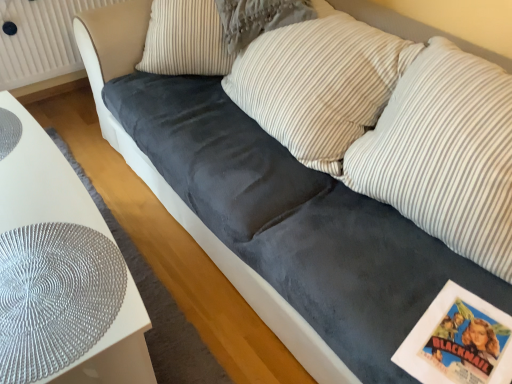
Question: Does white textured radiator at upper left have a larger size compared to striped fabric pillow at center, the 2th pillow when ordered from left to right?

Choices:
 (A) yes
 (B) no

Answer: (B)

Question: From the image's perspective, is white textured radiator at upper left on striped fabric pillow at center, placed as the 3th pillow when sorted from right to left?

Choices:
 (A) yes
 (B) no

Answer: (A)

Question: Considering the relative sizes of white textured radiator at upper left and striped fabric pillow at center, the 2th pillow when ordered from left to right, in the image provided, is white textured radiator at upper left wider than striped fabric pillow at center, the 2th pillow when ordered from left to right,?

Choices:
 (A) yes
 (B) no

Answer: (B)

Question: Is white textured radiator at upper left directly adjacent to striped fabric pillow at center, the 2th pillow when ordered from left to right?

Choices:
 (A) no
 (B) yes

Answer: (A)

Question: From the image's perspective, is white textured radiator at upper left beneath striped fabric pillow at center, placed as the 3th pillow when sorted from right to left?

Choices:
 (A) no
 (B) yes

Answer: (A)

Question: Is striped fabric pillow at center, placed as the 3th pillow when sorted from right to left, in front of or behind white striped pillow at center, acting as the 3th pillow starting from the left, in the image?

Choices:
 (A) behind
 (B) front

Answer: (A)

Question: From the image's perspective, relative to white striped pillow at center, positioned as the second pillow in right-to-left order, is striped fabric pillow at center, the 2th pillow when ordered from left to right, above or below?

Choices:
 (A) below
 (B) above

Answer: (B)

Question: Considering the positions of striped fabric pillow at center, placed as the 3th pillow when sorted from right to left, and white striped pillow at center, positioned as the second pillow in right-to-left order, in the image, is striped fabric pillow at center, placed as the 3th pillow when sorted from right to left, taller or shorter than white striped pillow at center, positioned as the second pillow in right-to-left order,?

Choices:
 (A) short
 (B) tall

Answer: (A)

Question: Looking at their shapes, would you say striped fabric pillow at center, placed as the 3th pillow when sorted from right to left, is wider or thinner than white striped pillow at center, acting as the 3th pillow starting from the left?

Choices:
 (A) thin
 (B) wide

Answer: (B)

Question: Is white striped pillow at center, positioned as the second pillow in right-to-left order, inside the boundaries of velvet gray pillow at center, placed as the first pillow when sorted from left to right, or outside?

Choices:
 (A) outside
 (B) inside

Answer: (A)

Question: From a real-world perspective, is white striped pillow at center, positioned as the second pillow in right-to-left order, above or below velvet gray pillow at center, placed as the first pillow when sorted from left to right?

Choices:
 (A) above
 (B) below

Answer: (A)

Question: Is white striped pillow at center, positioned as the second pillow in right-to-left order, bigger or smaller than velvet gray pillow at center, which is the 4th pillow from right to left?

Choices:
 (A) small
 (B) big

Answer: (B)

Question: Considering the positions of point (313, 162) and point (150, 33), is point (313, 162) closer or farther from the camera than point (150, 33)?

Choices:
 (A) farther
 (B) closer

Answer: (B)

Question: From the image's perspective, is white glossy table at lower left above or below striped fabric pillow at center, the 2th pillow when ordered from left to right?

Choices:
 (A) below
 (B) above

Answer: (A)

Question: In terms of height, does white glossy table at lower left look taller or shorter compared to striped fabric pillow at center, the 2th pillow when ordered from left to right?

Choices:
 (A) short
 (B) tall

Answer: (B)